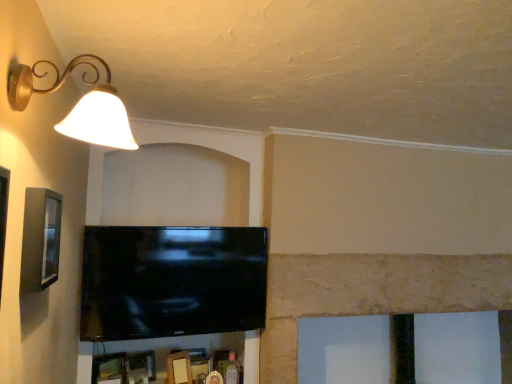
Question: Is matte gray picture frame at left outside black glossy tv at center?

Choices:
 (A) yes
 (B) no

Answer: (A)

Question: Is there a large distance between matte gray picture frame at left and black glossy tv at center?

Choices:
 (A) no
 (B) yes

Answer: (A)

Question: Can you confirm if matte gray picture frame at left is shorter than black glossy tv at center?

Choices:
 (A) yes
 (B) no

Answer: (A)

Question: Can you confirm if matte gray picture frame at left is smaller than black glossy tv at center?

Choices:
 (A) no
 (B) yes

Answer: (B)

Question: Is matte gray picture frame at left closer to camera compared to black glossy tv at center?

Choices:
 (A) no
 (B) yes

Answer: (B)

Question: From a real-world perspective, is matte gray picture frame at left below black glossy tv at center?

Choices:
 (A) no
 (B) yes

Answer: (A)

Question: From a real-world perspective, is black glossy tv at center positioned under matte gray picture frame at left based on gravity?

Choices:
 (A) yes
 (B) no

Answer: (A)

Question: Does black glossy tv at center have a greater height compared to matte gray picture frame at left?

Choices:
 (A) no
 (B) yes

Answer: (B)

Question: Are black glossy tv at center and matte gray picture frame at left far apart?

Choices:
 (A) no
 (B) yes

Answer: (A)

Question: Does black glossy tv at center have a larger size compared to matte gray picture frame at left?

Choices:
 (A) yes
 (B) no

Answer: (A)

Question: Is the depth of black glossy tv at center less than that of matte gray picture frame at left?

Choices:
 (A) no
 (B) yes

Answer: (A)

Question: Is black glossy tv at center facing towards matte gray picture frame at left?

Choices:
 (A) no
 (B) yes

Answer: (B)

Question: Is matte gold lampshade at upper left positioned behind black glossy tv at center?

Choices:
 (A) no
 (B) yes

Answer: (A)